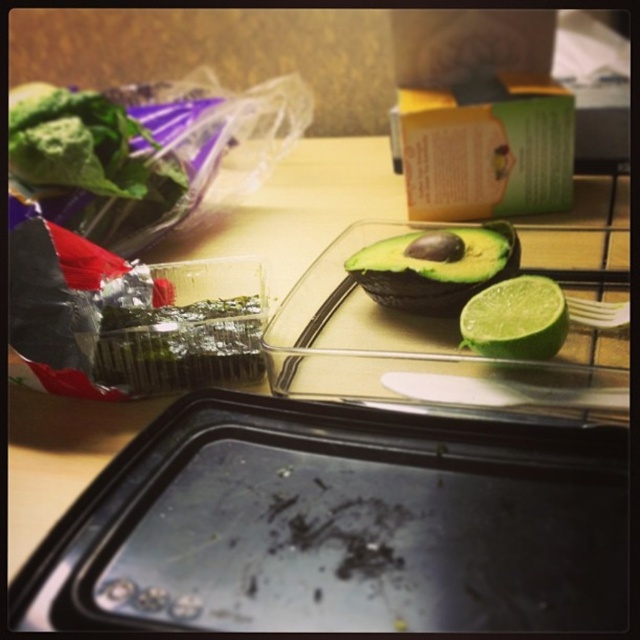
You are organizing the items on the kitchen countertop. The black matte tray at center and the green leafy vegetable at upper left need to be placed side by side. Which one should be placed first to ensure they fit properly?

The black matte tray at center is wider than the green leafy vegetable at upper left, so it should be placed first to accommodate its larger width.

You are preparing a salad and need to grab both the green leafy vegetable at upper left and the green matte lime at center. Which one is closer to your hand if you reach from above the image?

The green leafy vegetable at upper left is positioned over the green matte lime at center, so it is closer to your hand when reaching from above.

You are preparing a dish and need to place the green matte lime at center to the right of the black matte tray at center. Is the current arrangement already meeting this requirement?

The black matte tray at center is positioned on the left side of green matte lime at center, so yes, the current arrangement already meets the requirement.